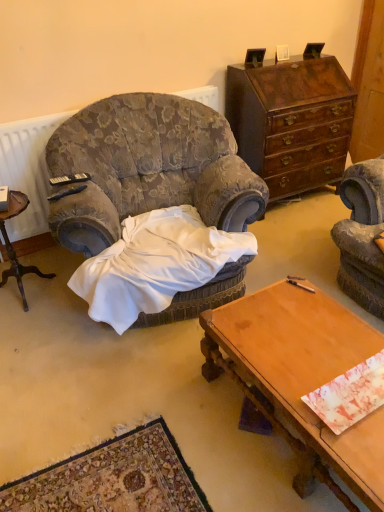
Question: Does white satin blanket at center have a greater width compared to wooden desk at lower right?

Choices:
 (A) yes
 (B) no

Answer: (A)

Question: Considering the relative sizes of white satin blanket at center and wooden desk at lower right in the image provided, is white satin blanket at center taller than wooden desk at lower right?

Choices:
 (A) yes
 (B) no

Answer: (A)

Question: Considering the relative positions of white satin blanket at center and wooden desk at lower right in the image provided, is white satin blanket at center behind wooden desk at lower right?

Choices:
 (A) no
 (B) yes

Answer: (B)

Question: Can you confirm if white satin blanket at center is smaller than wooden desk at lower right?

Choices:
 (A) no
 (B) yes

Answer: (A)

Question: Considering the relative sizes of white satin blanket at center and wooden desk at lower right in the image provided, is white satin blanket at center thinner than wooden desk at lower right?

Choices:
 (A) yes
 (B) no

Answer: (B)

Question: Is white satin blanket at center closer to camera compared to wooden desk at lower right?

Choices:
 (A) no
 (B) yes

Answer: (A)

Question: From the image's perspective, would you say wooden desk at lower right is positioned over mahogany wood dresser at upper right?

Choices:
 (A) no
 (B) yes

Answer: (A)

Question: Considering the relative positions of wooden desk at lower right and mahogany wood dresser at upper right in the image provided, is wooden desk at lower right to the right of mahogany wood dresser at upper right from the viewer's perspective?

Choices:
 (A) yes
 (B) no

Answer: (B)

Question: Considering the relative sizes of wooden desk at lower right and mahogany wood dresser at upper right in the image provided, is wooden desk at lower right smaller than mahogany wood dresser at upper right?

Choices:
 (A) no
 (B) yes

Answer: (B)

Question: Considering the relative positions of wooden desk at lower right and mahogany wood dresser at upper right in the image provided, is wooden desk at lower right to the left of mahogany wood dresser at upper right from the viewer's perspective?

Choices:
 (A) no
 (B) yes

Answer: (B)

Question: From a real-world perspective, is wooden desk at lower right on top of mahogany wood dresser at upper right?

Choices:
 (A) no
 (B) yes

Answer: (A)

Question: Is wooden desk at lower right wider than mahogany wood dresser at upper right?

Choices:
 (A) no
 (B) yes

Answer: (B)

Question: Is mahogany wood dresser at upper right to the left of white satin blanket at center from the viewer's perspective?

Choices:
 (A) yes
 (B) no

Answer: (B)